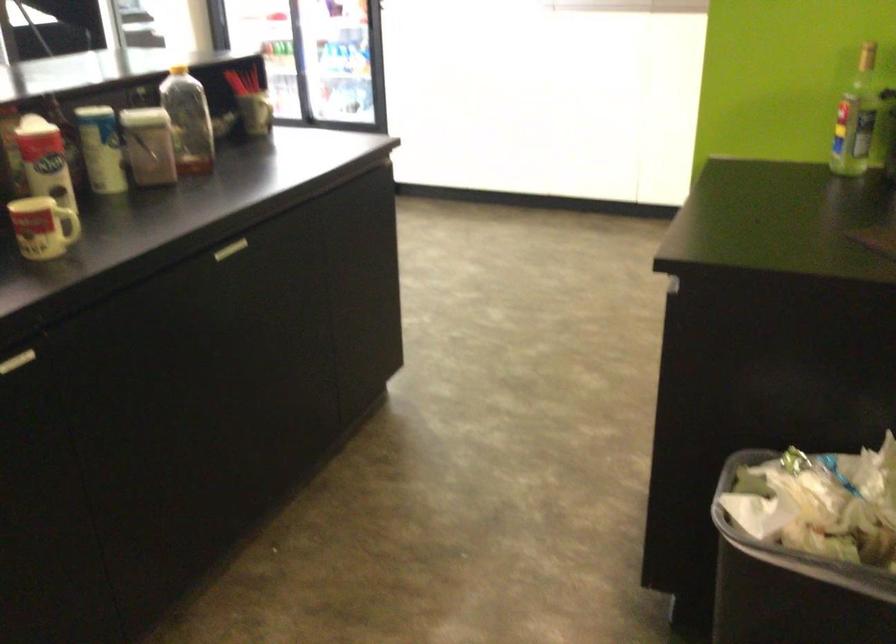
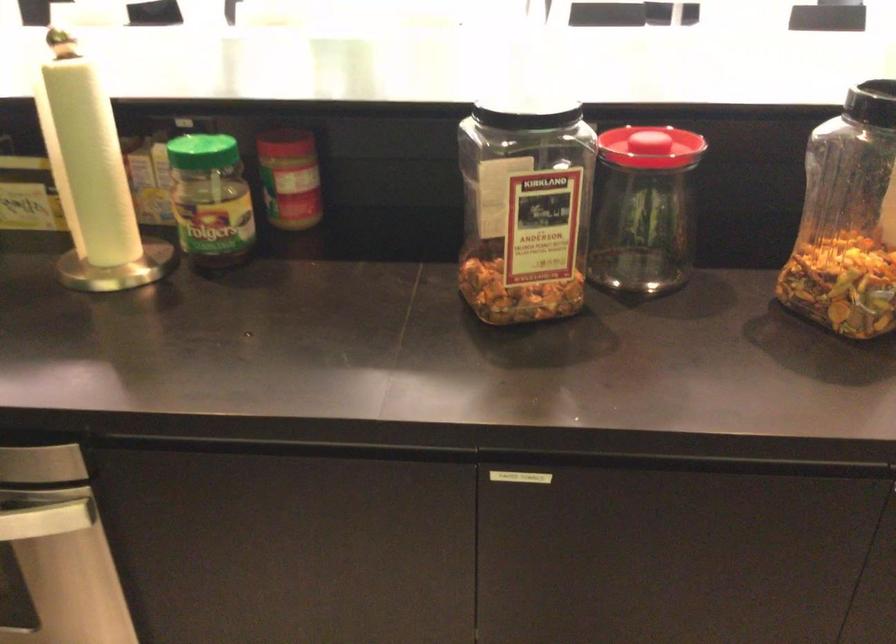
How did the camera likely rotate?

The rotation direction of the camera is left-down.